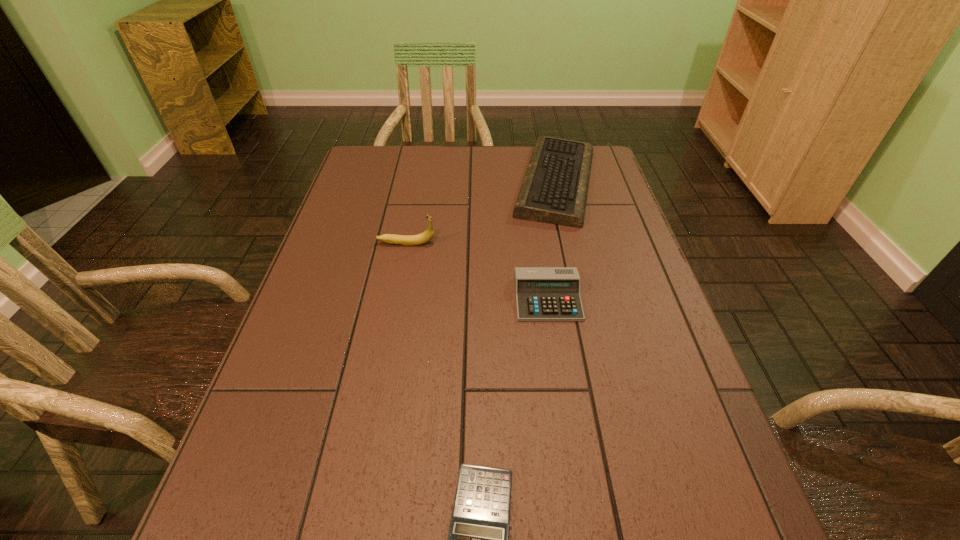
Locate an element on the screen. This screenshot has width=960, height=540. object that is the third closest to the right calculator is located at coordinates [477, 539].

Identify the location of vacant space that satisfies the following two spatial constraints: 1. on the back side of the taller calculator; 2. at the stem of the tallest object. pos(540,243).

Identify the location of free space that satisfies the following two spatial constraints: 1. at the stem of the right calculator; 2. on the right side of the leftmost object. The image size is (960, 540). (396, 299).

What are the coordinates of `free space in the image that satisfies the following two spatial constraints: 1. at the stem of the third farthest object; 2. on the right side of the leftmost object` in the screenshot? It's located at (396, 299).